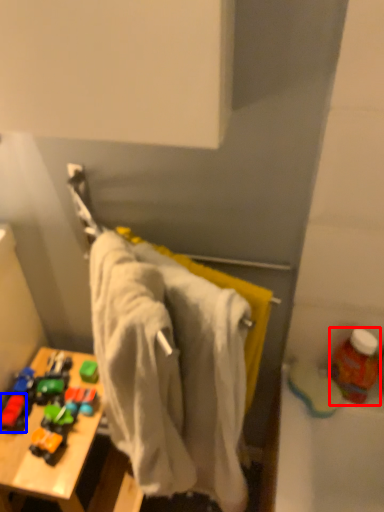
Question: Which object appears closest to the camera in this image, bottle (highlighted by a red box) or toy (highlighted by a blue box)?

Choices:
 (A) bottle
 (B) toy

Answer: (A)